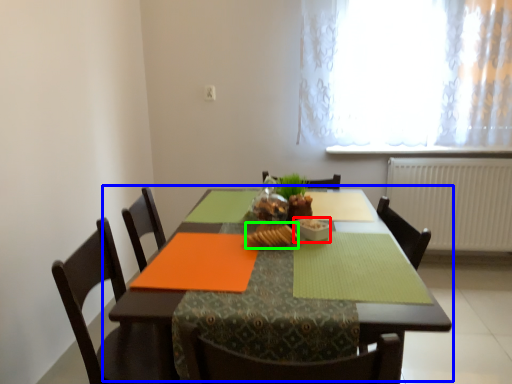
Question: Estimate the real-world distances between objects in this image. Which object is closer to tableware (highlighted by a red box), table (highlighted by a blue box) or food (highlighted by a green box)?

Choices:
 (A) table
 (B) food

Answer: (B)